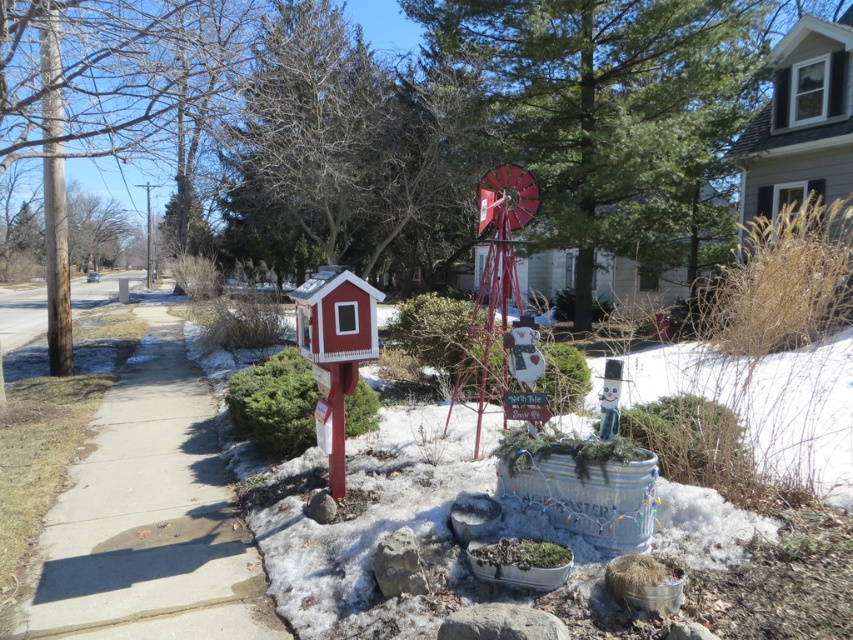
You are standing at the entrance of the garden and want to walk to the red post with the birdhouse. According to the image, where is the concrete sidewalk at center located relative to your starting position?

The concrete sidewalk at center is located at point (x=149, y=515) relative to your starting position.

You are standing on the concrete sidewalk at center and want to walk towards the brown wood pole at left. Which direction should you face to move directly towards it?

You should face to the left to move directly towards the brown wood pole at left from the concrete sidewalk at center because the sidewalk is in front of the pole, indicating the pole is positioned to the left side relative to the sidewalk.